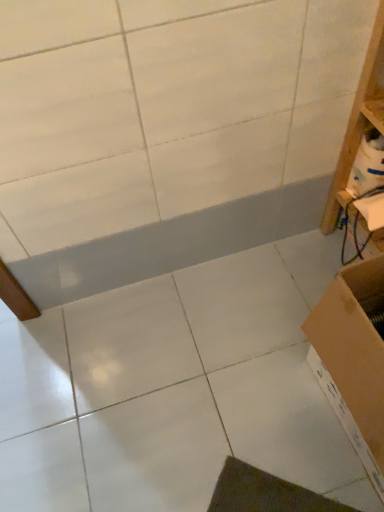
The height and width of the screenshot is (512, 384). I want to click on free spot behind brown cardboard box at lower right, so click(280, 304).